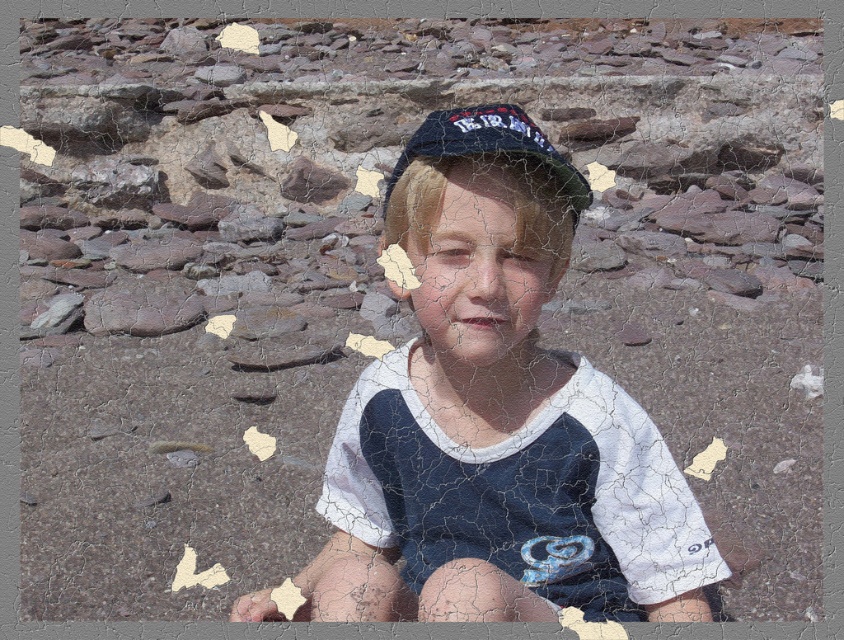
Who is shorter, white mesh shirt at center or dark blue fabric baseball hat at center?

Standing shorter between the two is dark blue fabric baseball hat at center.

Find the location of `white mesh shirt at center`. white mesh shirt at center is located at coordinates (496, 419).

Identify the location of white mesh shirt at center. (496, 419).

Where is `white mesh shirt at center`? Image resolution: width=844 pixels, height=640 pixels. white mesh shirt at center is located at coordinates (496, 419).